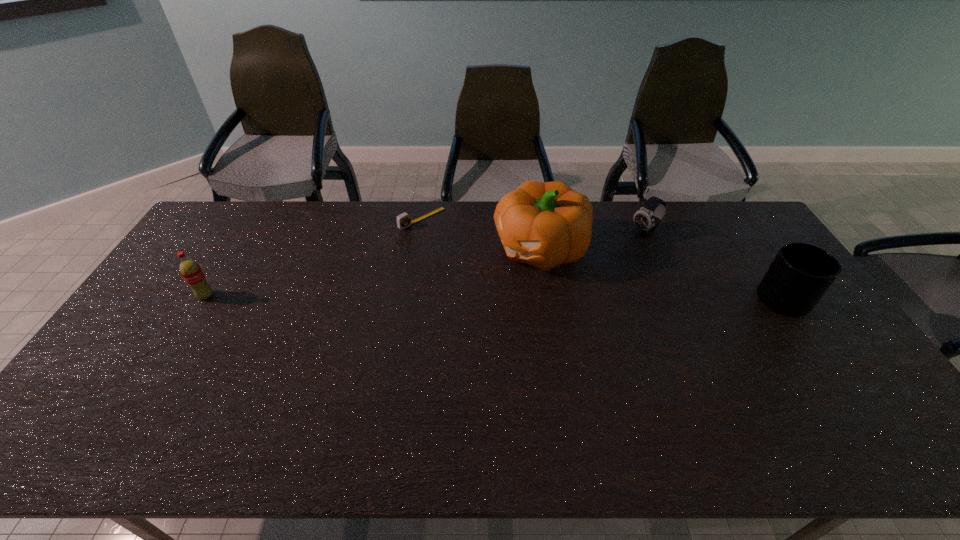
Locate an element on the screen. This screenshot has height=540, width=960. soda is located at coordinates (190, 270).

Where is `the rightmost object`? The height and width of the screenshot is (540, 960). the rightmost object is located at coordinates click(800, 274).

Image resolution: width=960 pixels, height=540 pixels. I want to click on pumpkin, so click(544, 224).

Locate an element on the screen. The image size is (960, 540). the tallest object is located at coordinates (544, 224).

In order to click on tape measure in this screenshot , I will do `click(403, 220)`.

You are a GUI agent. You are given a task and a screenshot of the screen. Output one action in this format:
    pyautogui.click(x=<x>, y=<y>)
    Task: Click on the shortest object
    This screenshot has height=540, width=960.
    Given the screenshot: What is the action you would take?
    pyautogui.click(x=403, y=220)

Identify the location of the second shortest object. pos(647,219).

This screenshot has width=960, height=540. Identify the location of the fourth object from left to right. (647, 219).

Where is `blank space located on the right of the soda`? The image size is (960, 540). blank space located on the right of the soda is located at coordinates (325, 296).

The image size is (960, 540). In order to click on free region located 0.250m on the carved face of the pumpkin in this screenshot , I will do `click(440, 303)`.